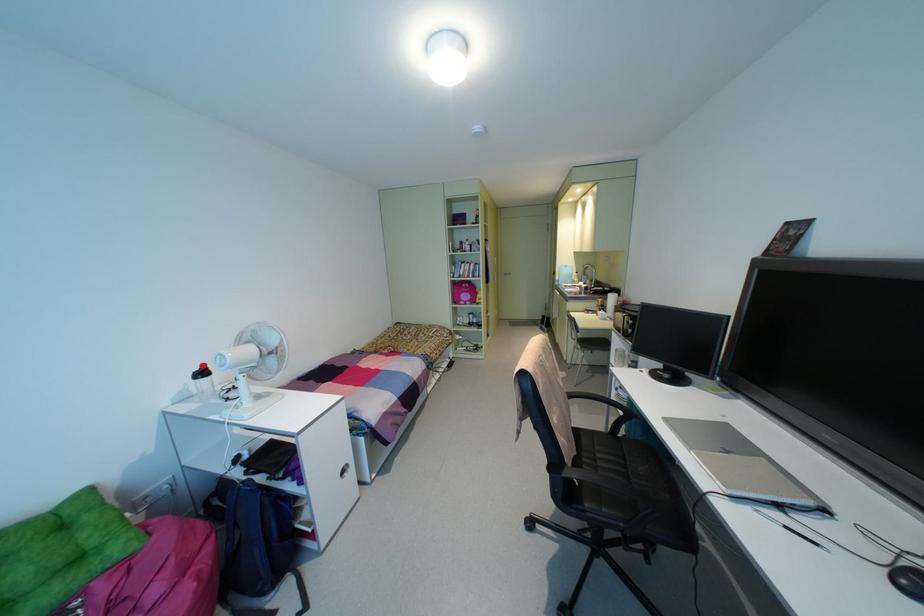
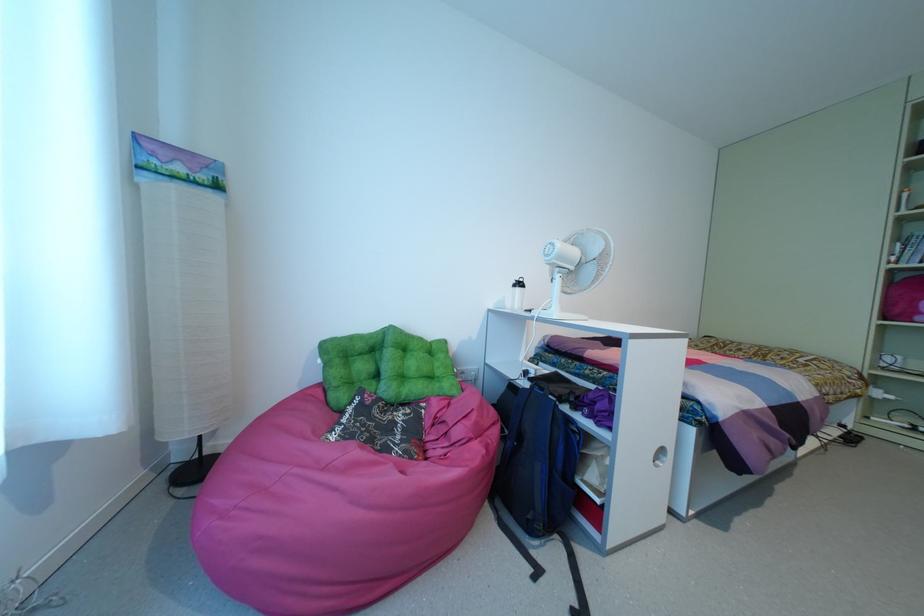
Question: I am providing you with two images of the same scene from different viewpoints. A red point is shown in image1. For the corresponding object point in image2, is it positioned nearer or farther from the camera?

Choices:
 (A) Nearer
 (B) Farther

Answer: (A)